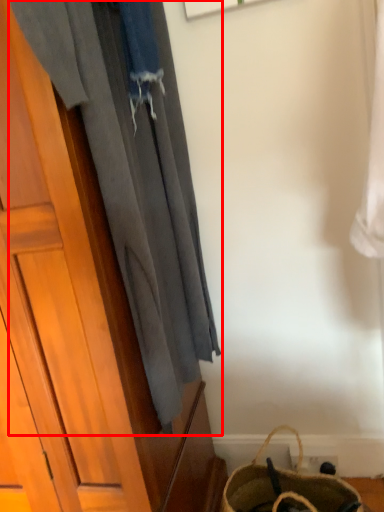
Question: From the image's perspective, where is curtain (annotated by the red box) located relative to handbag?

Choices:
 (A) below
 (B) above

Answer: (B)